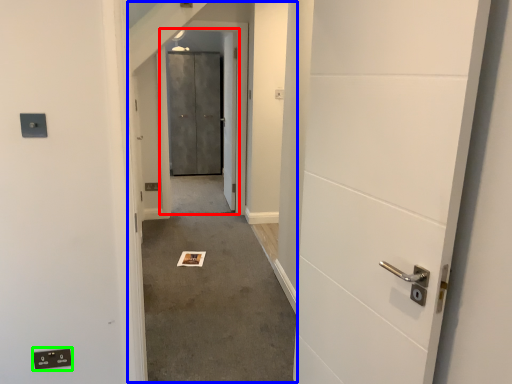
Question: Estimate the real-world distances between objects in this image. Which object is closer to elevator door (highlighted by a red box), corridor (highlighted by a blue box) or electric outlet (highlighted by a green box)?

Choices:
 (A) corridor
 (B) electric outlet

Answer: (A)